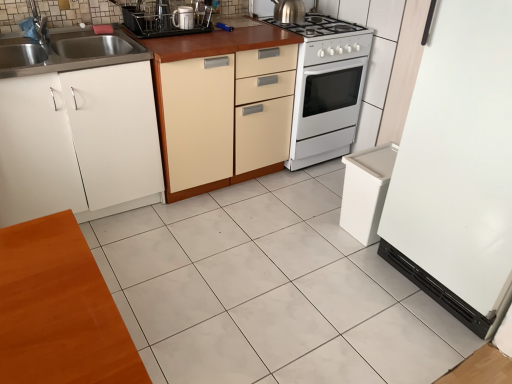
What do you see at coordinates (78, 142) in the screenshot?
I see `white matte cabinet at left, which is the 2th cabinetry from right to left` at bounding box center [78, 142].

What do you see at coordinates (327, 88) in the screenshot? This screenshot has height=384, width=512. I see `white glossy stove at center` at bounding box center [327, 88].

Find the location of a particular element. white glossy gas stove at upper center is located at coordinates (329, 38).

Where is `white glossy coffee maker at center, which is the second kitchen appliance in back-to-front order`? white glossy coffee maker at center, which is the second kitchen appliance in back-to-front order is located at coordinates (183, 18).

This screenshot has width=512, height=384. I want to click on white glossy refrigerator at right, positioned as the second appliance in left-to-right order, so pyautogui.click(x=458, y=168).

Identify the location of beige wood cabinet at center, which is the 1th cabinetry in right-to-left order. (222, 120).

Find the location of a particular element. polished stainless steel kettle at upper center, acting as the second kitchen appliance starting from the left is located at coordinates (289, 11).

Is white glossy gas stove at upper center aimed at polished stainless steel kettle at upper center, arranged as the 2th kitchen appliance when ordered from the bottom?

No.

Between white glossy gas stove at upper center and polished stainless steel kettle at upper center, acting as the second kitchen appliance starting from the left, which one has more height?

Standing taller between the two is white glossy gas stove at upper center.

Considering the sizes of objects white glossy gas stove at upper center and polished stainless steel kettle at upper center, arranged as the second kitchen appliance when viewed from the front, in the image provided, who is thinner, white glossy gas stove at upper center or polished stainless steel kettle at upper center, arranged as the second kitchen appliance when viewed from the front,?

polished stainless steel kettle at upper center, arranged as the second kitchen appliance when viewed from the front, is thinner.

Is white glossy gas stove at upper center smaller than polished stainless steel kettle at upper center, acting as the second kitchen appliance starting from the left?

Incorrect, white glossy gas stove at upper center is not smaller in size than polished stainless steel kettle at upper center, acting as the second kitchen appliance starting from the left.

Which object is positioned more to the left, polished stainless steel kettle at upper center, arranged as the 1th kitchen appliance when viewed from the right, or white glossy coffee maker at center, which appears as the second kitchen appliance when viewed from the right?

Positioned to the left is white glossy coffee maker at center, which appears as the second kitchen appliance when viewed from the right.

Is polished stainless steel kettle at upper center, which ranks as the first kitchen appliance in top-to-bottom order, taller or shorter than white glossy coffee maker at center, the first kitchen appliance when ordered from front to back?

In the image, polished stainless steel kettle at upper center, which ranks as the first kitchen appliance in top-to-bottom order, appears to be taller than white glossy coffee maker at center, the first kitchen appliance when ordered from front to back.

Do you think polished stainless steel kettle at upper center, the first kitchen appliance positioned from the back, is within white glossy coffee maker at center, the 1th kitchen appliance ordered from the bottom, or outside of it?

polished stainless steel kettle at upper center, the first kitchen appliance positioned from the back, is located beyond the bounds of white glossy coffee maker at center, the 1th kitchen appliance ordered from the bottom.

Is polished stainless steel kettle at upper center, the first kitchen appliance positioned from the back, positioned with its back to white glossy coffee maker at center, which appears as the second kitchen appliance when viewed from the right?

polished stainless steel kettle at upper center, the first kitchen appliance positioned from the back, is not turned away from white glossy coffee maker at center, which appears as the second kitchen appliance when viewed from the right.

Which of these two, white glossy coffee maker at center, the first kitchen appliance when ordered from front to back, or white glossy tile at center, is bigger?

white glossy tile at center.

Considering the sizes of objects white glossy coffee maker at center, which appears as the second kitchen appliance when viewed from the right, and white glossy tile at center in the image provided, who is shorter, white glossy coffee maker at center, which appears as the second kitchen appliance when viewed from the right, or white glossy tile at center?

white glossy tile at center.

Is point (185, 9) behind point (314, 175)?

No.

Are white glossy coffee maker at center, the first kitchen appliance in the left-to-right sequence, and white glossy tile at center located far from each other?

That's right, there is a large distance between white glossy coffee maker at center, the first kitchen appliance in the left-to-right sequence, and white glossy tile at center.

Is point (185, 14) positioned behind point (166, 5)?

Yes, it is.

Based on the photo, does white glossy coffee maker at center, the first kitchen appliance when ordered from front to back, have a lesser width compared to metallic stainless steel dish rack at upper center, the 1th appliance from the top?

Correct, the width of white glossy coffee maker at center, the first kitchen appliance when ordered from front to back, is less than that of metallic stainless steel dish rack at upper center, the 1th appliance from the top.

Is white glossy coffee maker at center, which is the second kitchen appliance in back-to-front order, bigger than metallic stainless steel dish rack at upper center, positioned as the 1th appliance in left-to-right order?

Actually, white glossy coffee maker at center, which is the second kitchen appliance in back-to-front order, might be smaller than metallic stainless steel dish rack at upper center, positioned as the 1th appliance in left-to-right order.

Is white glossy refrigerator at right, positioned as the 1th appliance in right-to-left order, at the right side of white glossy stove at center?

Yes, white glossy refrigerator at right, positioned as the 1th appliance in right-to-left order, is to the right of white glossy stove at center.

From a real-world perspective, which object stands above the other?

white glossy refrigerator at right, positioned as the 1th appliance in right-to-left order.

Measure the distance from white glossy refrigerator at right, positioned as the 1th appliance in right-to-left order, to white glossy stove at center.

They are 1.02 meters apart.

Is white glossy stove at center thinner than white matte cabinet at left, which is the 2th cabinetry from right to left?

Incorrect, the width of white glossy stove at center is not less than that of white matte cabinet at left, which is the 2th cabinetry from right to left.

Is white matte cabinet at left, which is the 1th cabinetry in left-to-right order, surrounded by white glossy stove at center?

No, white glossy stove at center does not contain white matte cabinet at left, which is the 1th cabinetry in left-to-right order.

Does white glossy stove at center appear on the left side of white matte cabinet at left, which is the 1th cabinetry in left-to-right order?

No, white glossy stove at center is not to the left of white matte cabinet at left, which is the 1th cabinetry in left-to-right order.

In the scene shown: Considering the relative positions of white glossy stove at center and white matte cabinet at left, which is the 2th cabinetry from right to left, in the image provided, is white glossy stove at center in front of white matte cabinet at left, which is the 2th cabinetry from right to left,?

No, white glossy stove at center is further to the viewer.

Could you tell me if white matte cabinet at left, which is the 2th cabinetry from right to left, is turned towards white glossy refrigerator at right, which is the first appliance from bottom to top?

No, white matte cabinet at left, which is the 2th cabinetry from right to left, is not oriented towards white glossy refrigerator at right, which is the first appliance from bottom to top.

Identify the location of the 1st cabinetry positioned above the white glossy refrigerator at right, which is the first appliance from bottom to top (from the image's perspective). The image size is (512, 384). (78, 142).

In terms of width, does white matte cabinet at left, which is the 1th cabinetry in left-to-right order, look wider or thinner when compared to white glossy refrigerator at right, which is the first appliance from bottom to top?

In the image, white matte cabinet at left, which is the 1th cabinetry in left-to-right order, appears to be more narrow than white glossy refrigerator at right, which is the first appliance from bottom to top.

In the image, there is a white glossy gas stove at upper center. Where is `kitchen appliance above it (from the image's perspective)`? The width and height of the screenshot is (512, 384). kitchen appliance above it (from the image's perspective) is located at coordinates (289, 11).

Identify the location of kitchen appliance in front of the polished stainless steel kettle at upper center, the first kitchen appliance positioned from the back. The width and height of the screenshot is (512, 384). (183, 18).

Considering their positions, is white glossy refrigerator at right, which is the first appliance from bottom to top, positioned further to white matte cabinet at left, which is the 2th cabinetry from right to left, than white glossy gas stove at upper center?

Among the two, white glossy refrigerator at right, which is the first appliance from bottom to top, is located further to white matte cabinet at left, which is the 2th cabinetry from right to left.

Based on their spatial positions, is white glossy stove at center or white matte cabinet at left, which is the 2th cabinetry from right to left, further from white glossy gas stove at upper center?

white matte cabinet at left, which is the 2th cabinetry from right to left, is positioned further to the anchor white glossy gas stove at upper center.

When comparing their distances from white glossy refrigerator at right, positioned as the 1th appliance in right-to-left order, does white glossy stove at center or white glossy gas stove at upper center seem closer?

Among the two, white glossy stove at center is located nearer to white glossy refrigerator at right, positioned as the 1th appliance in right-to-left order.

Looking at the image, which one is located further to white matte cabinet at left, which is the 1th cabinetry in left-to-right order, metallic stainless steel dish rack at upper center, the 1th appliance from the top, or white glossy gas stove at upper center?

white glossy gas stove at upper center is positioned further to the anchor white matte cabinet at left, which is the 1th cabinetry in left-to-right order.

Which object lies nearer to the anchor point white glossy refrigerator at right, marked as the 2th appliance in a top-to-bottom arrangement, polished stainless steel kettle at upper center, arranged as the 2th kitchen appliance when ordered from the bottom, or white glossy coffee maker at center, the first kitchen appliance in the left-to-right sequence?

The object closer to white glossy refrigerator at right, marked as the 2th appliance in a top-to-bottom arrangement, is polished stainless steel kettle at upper center, arranged as the 2th kitchen appliance when ordered from the bottom.

Which object lies nearer to the anchor point white matte cabinet at left, which is the 2th cabinetry from right to left, white glossy stove at center or beige wood cabinet at center, which is the 1th cabinetry in right-to-left order?

The object closer to white matte cabinet at left, which is the 2th cabinetry from right to left, is beige wood cabinet at center, which is the 1th cabinetry in right-to-left order.

Estimate the real-world distances between objects in this image. Which object is further from white glossy coffee maker at center, which appears as the second kitchen appliance when viewed from the right, polished stainless steel kettle at upper center, which ranks as the first kitchen appliance in top-to-bottom order, or white glossy refrigerator at right, positioned as the second appliance in left-to-right order?

Based on the image, white glossy refrigerator at right, positioned as the second appliance in left-to-right order, appears to be further to white glossy coffee maker at center, which appears as the second kitchen appliance when viewed from the right.

Considering their positions, is polished stainless steel kettle at upper center, arranged as the 2th kitchen appliance when ordered from the bottom, positioned closer to white glossy tile at center than metallic stainless steel dish rack at upper center, which appears as the second appliance when ordered from the bottom?

metallic stainless steel dish rack at upper center, which appears as the second appliance when ordered from the bottom.

Where is `kitchen appliance between white matte cabinet at left, which is the 2th cabinetry from right to left, and polished stainless steel kettle at upper center, which ranks as the first kitchen appliance in top-to-bottom order, in the horizontal direction`? kitchen appliance between white matte cabinet at left, which is the 2th cabinetry from right to left, and polished stainless steel kettle at upper center, which ranks as the first kitchen appliance in top-to-bottom order, in the horizontal direction is located at coordinates (183, 18).

This screenshot has width=512, height=384. What are the coordinates of `appliance located between white matte cabinet at left, which is the 2th cabinetry from right to left, and polished stainless steel kettle at upper center, arranged as the 1th kitchen appliance when viewed from the right, in the left-right direction` in the screenshot? It's located at (167, 17).

The height and width of the screenshot is (384, 512). What are the coordinates of `kitchen appliance between polished stainless steel kettle at upper center, arranged as the second kitchen appliance when viewed from the front, and white glossy tile at center from top to bottom` in the screenshot? It's located at (183, 18).

Identify the location of appliance between white glossy tile at center and white glossy stove at center along the z-axis. This screenshot has height=384, width=512. (167, 17).